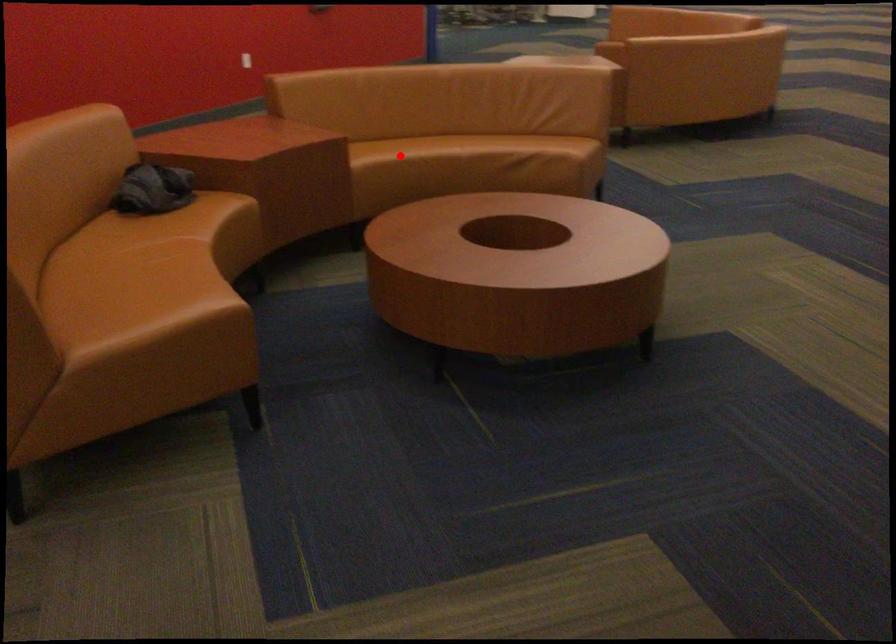
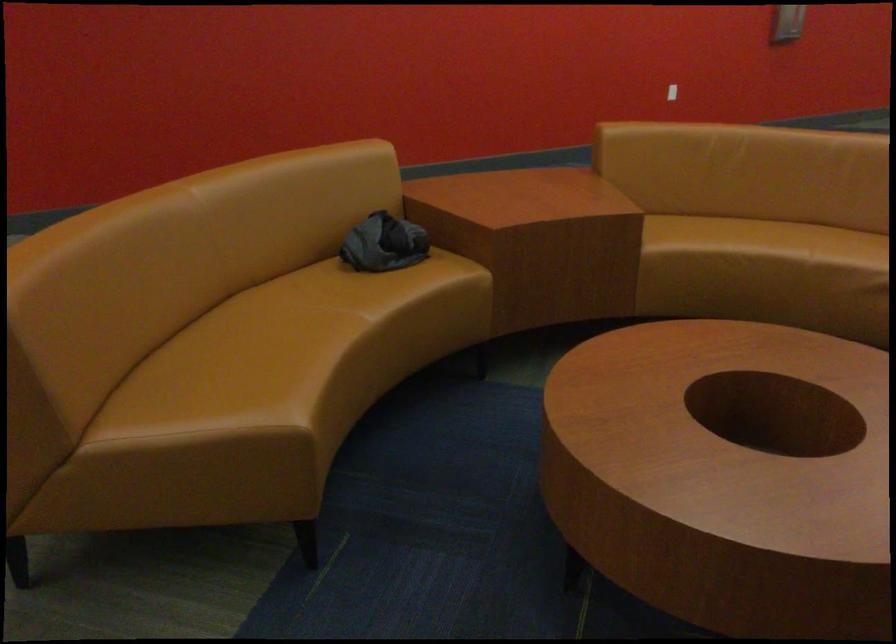
Find the pixel in the second image that matches the highlighted location in the first image.

(719, 242)